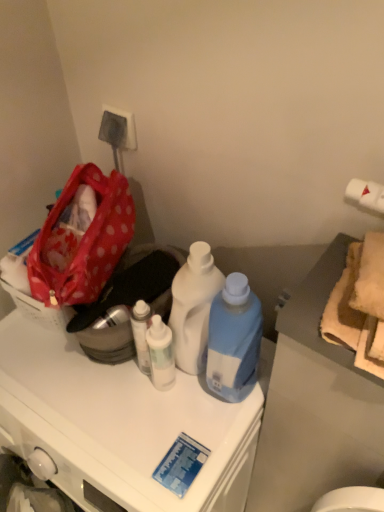
In order to click on free space in front of polka dot fabric picnic basket at left in this screenshot , I will do `click(42, 374)`.